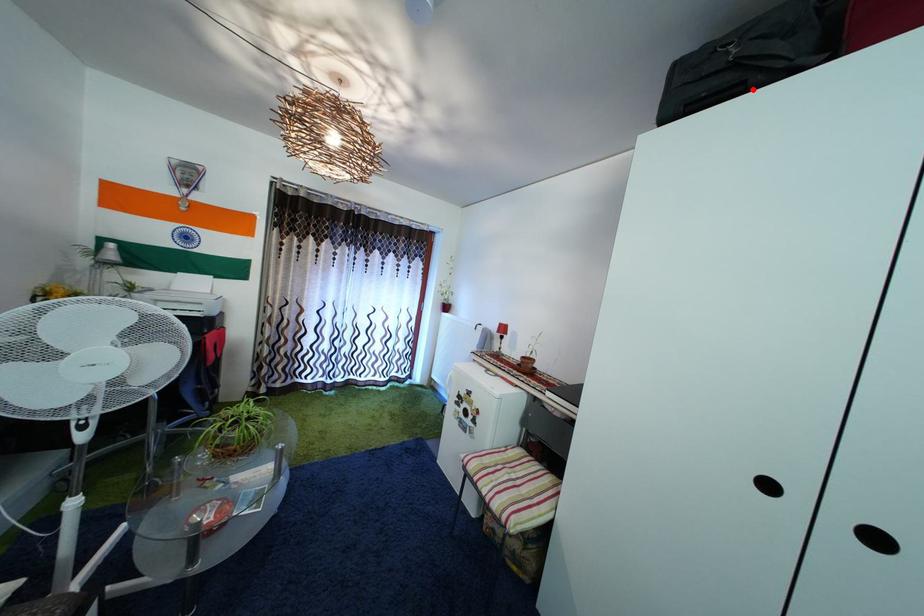
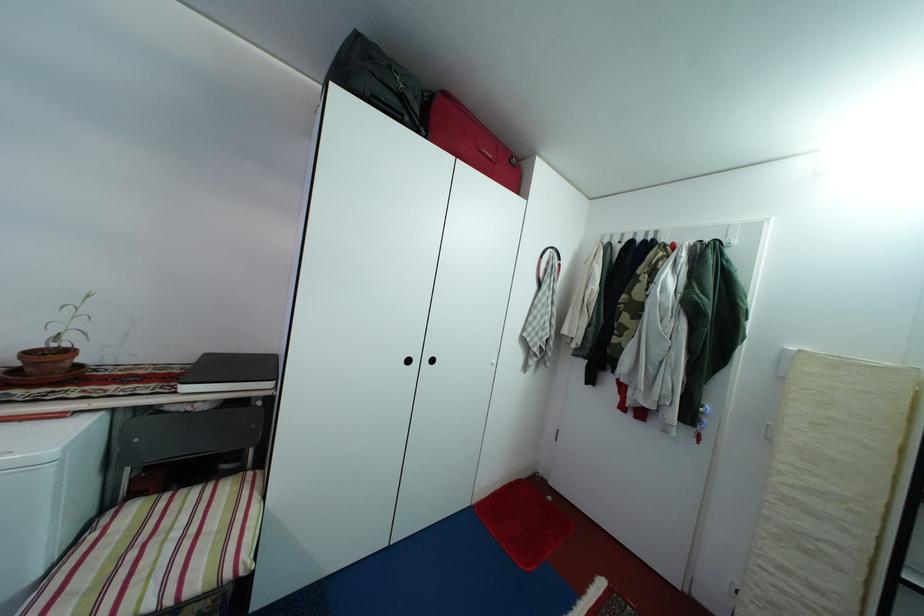
In the second image, find the point that corresponds to the highlighted location in the first image.

(410, 123)